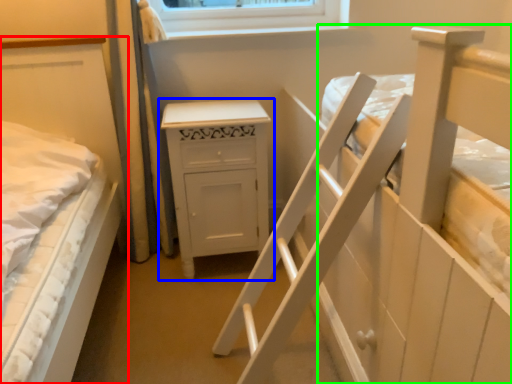
Question: Based on their relative distances, which object is farther from bed (highlighted by a red box)? Choose from chest of drawers (highlighted by a blue box) and bed (highlighted by a green box).

Choices:
 (A) chest of drawers
 (B) bed

Answer: (B)